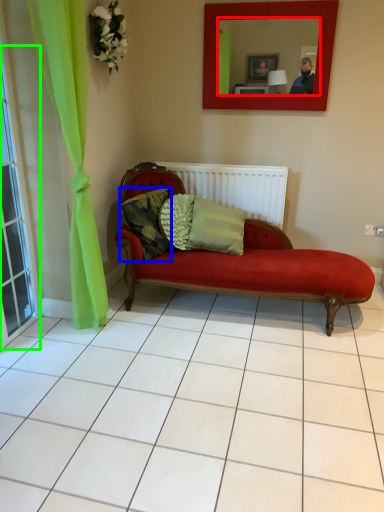
Question: Considering the real-world distances, which object is closest to mirror (highlighted by a red box)? pillow (highlighted by a blue box) or window (highlighted by a green box).

Choices:
 (A) pillow
 (B) window

Answer: (A)